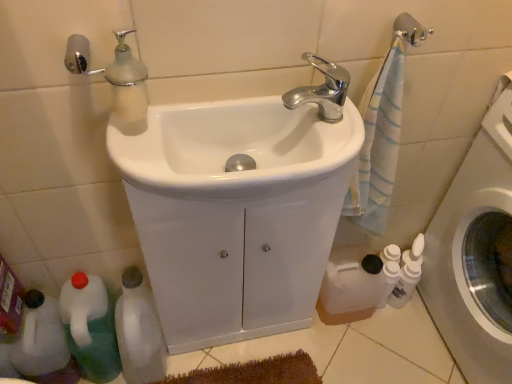
Question: Should I look upward or downward to see chrome metallic faucet at upper center?

Choices:
 (A) up
 (B) down

Answer: (A)

Question: Is silver metallic towel bar at upper right further to the viewer compared to white matte bottle at lower right, acting as the first bottle starting from the right?

Choices:
 (A) no
 (B) yes

Answer: (A)

Question: From a real-world perspective, does silver metallic towel bar at upper right stand above white matte bottle at lower right, acting as the first bottle starting from the right?

Choices:
 (A) yes
 (B) no

Answer: (A)

Question: Can you confirm if silver metallic towel bar at upper right is positioned to the left of white matte bottle at lower right, the third bottle from the left?

Choices:
 (A) no
 (B) yes

Answer: (B)

Question: From the image's perspective, would you say silver metallic towel bar at upper right is shown under white matte bottle at lower right, acting as the first bottle starting from the right?

Choices:
 (A) no
 (B) yes

Answer: (A)

Question: Considering the relative sizes of silver metallic towel bar at upper right and white matte bottle at lower right, the third bottle from the left, in the image provided, is silver metallic towel bar at upper right shorter than white matte bottle at lower right, the third bottle from the left,?

Choices:
 (A) yes
 (B) no

Answer: (A)

Question: From a real-world perspective, is silver metallic towel bar at upper right positioned under white matte bottle at lower right, the third bottle from the left, based on gravity?

Choices:
 (A) no
 (B) yes

Answer: (A)

Question: Considering the relative sizes of white glossy sink at center, positioned as the second sink in front-to-back order, and white matte bottle at lower right, acting as the first bottle starting from the right, in the image provided, is white glossy sink at center, positioned as the second sink in front-to-back order, bigger than white matte bottle at lower right, acting as the first bottle starting from the right,?

Choices:
 (A) yes
 (B) no

Answer: (A)

Question: From the image's perspective, is white glossy sink at center, positioned as the 1th sink in back-to-front order, below white matte bottle at lower right, the third bottle from the left?

Choices:
 (A) yes
 (B) no

Answer: (B)

Question: Considering the relative positions of white glossy sink at center, positioned as the second sink in front-to-back order, and white matte bottle at lower right, acting as the first bottle starting from the right, in the image provided, is white glossy sink at center, positioned as the second sink in front-to-back order, to the right of white matte bottle at lower right, acting as the first bottle starting from the right, from the viewer's perspective?

Choices:
 (A) yes
 (B) no

Answer: (B)

Question: Does white glossy sink at center, positioned as the second sink in front-to-back order, have a greater width compared to white matte bottle at lower right, the third bottle from the left?

Choices:
 (A) yes
 (B) no

Answer: (A)

Question: Considering the relative positions of white glossy sink at center, positioned as the 1th sink in back-to-front order, and white matte bottle at lower right, the third bottle from the left, in the image provided, is white glossy sink at center, positioned as the 1th sink in back-to-front order, to the left of white matte bottle at lower right, the third bottle from the left, from the viewer's perspective?

Choices:
 (A) no
 (B) yes

Answer: (B)

Question: From the image's perspective, is white glossy sink at center, positioned as the second sink in front-to-back order, over white matte bottle at lower right, acting as the first bottle starting from the right?

Choices:
 (A) yes
 (B) no

Answer: (A)

Question: Considering the relative positions of white glossy bottle at lower left, which is counted as the 2th bottle, starting from the right, and white glossy sink at center, acting as the first sink starting from the front, in the image provided, is white glossy bottle at lower left, which is counted as the 2th bottle, starting from the right, in front of white glossy sink at center, acting as the first sink starting from the front,?

Choices:
 (A) no
 (B) yes

Answer: (A)